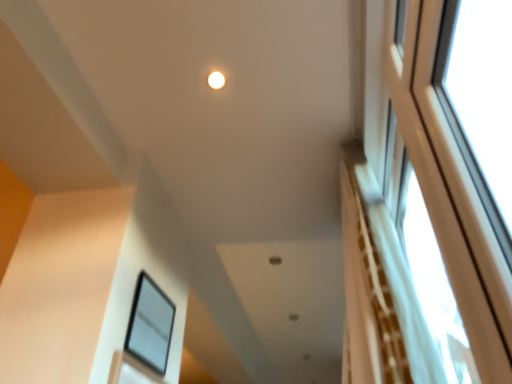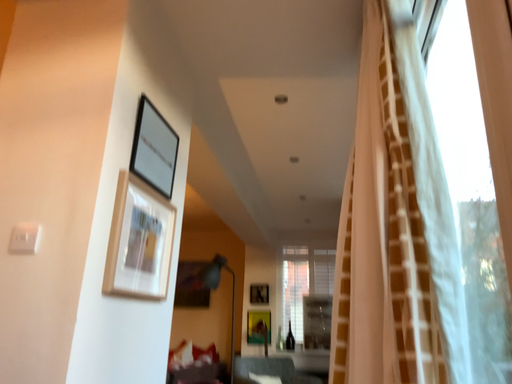
Question: How did the camera likely rotate when shooting the video?

Choices:
 (A) rotated upward
 (B) rotated downward

Answer: (B)